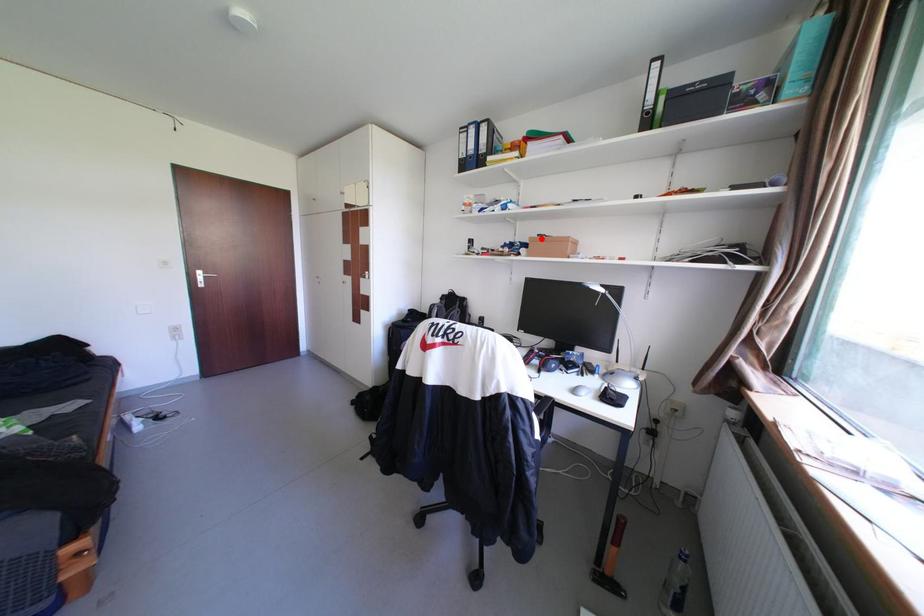
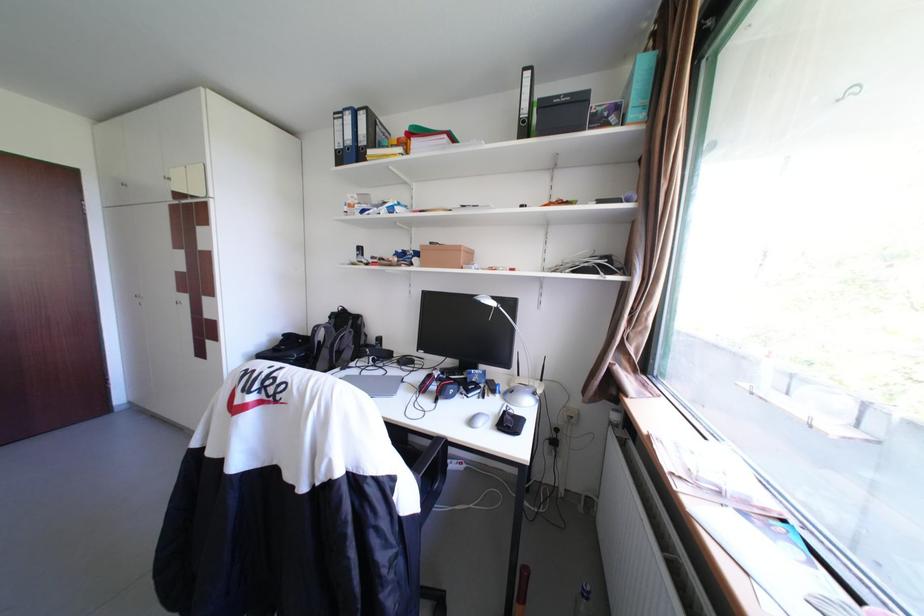
Question: I am providing you with two images of the same scene from different viewpoints. A red point is marked on the first image. Can you still see the location of the red point in image 2?

Choices:
 (A) Yes
 (B) No

Answer: (A)